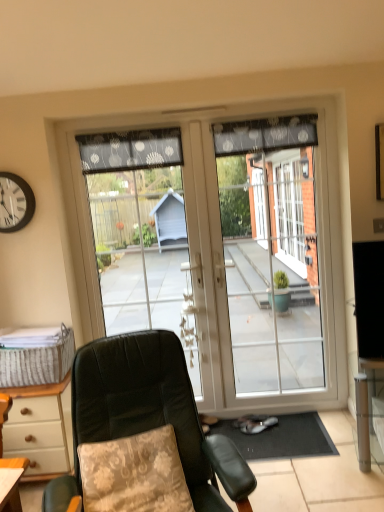
This screenshot has height=512, width=384. In order to click on transparent glass door at center in this screenshot , I will do `click(142, 234)`.

Measure the distance between transparent glass door at center and camera.

A distance of 2.70 meters exists between transparent glass door at center and camera.

You are a GUI agent. You are given a task and a screenshot of the screen. Output one action in this format:
    pyautogui.click(x=<x>, y=<y>)
    Task: Click on the black sheer curtain at upper center, which is the 2th curtain in left-to-right order
    This screenshot has height=512, width=384.
    Given the screenshot: What is the action you would take?
    pyautogui.click(x=264, y=135)

In order to face black sheer curtain at upper center, which is the 2th curtain in left-to-right order, should I rotate leftwards or rightwards?

To align with it, rotate right about 9.487°.

What is the approximate height of floral fabric pillow at lower left?

floral fabric pillow at lower left is 21.10 inches tall.

Find the location of a particular element. This screenshot has height=512, width=384. transparent glass door at center is located at coordinates (275, 267).

The width and height of the screenshot is (384, 512). Describe the element at coordinates (130, 150) in the screenshot. I see `dark gray dotted fabric at upper center, which ranks as the first curtain in left-to-right order` at that location.

Where is `leather-like green chair at center`? leather-like green chair at center is located at coordinates (134, 392).

Measure the distance between leather-like green chair at center and dark gray dotted fabric at upper center, which ranks as the first curtain in left-to-right order.

leather-like green chair at center and dark gray dotted fabric at upper center, which ranks as the first curtain in left-to-right order, are 1.41 meters apart from each other.

Between leather-like green chair at center and dark gray dotted fabric at upper center, which ranks as the first curtain in left-to-right order, which one has larger width?

leather-like green chair at center is wider.

Can you tell me how much leather-like green chair at center and dark gray dotted fabric at upper center, arranged as the second curtain when viewed from the right, differ in facing direction?

18.8 degrees.

Consider the image. Considering the positions of objects leather-like green chair at center and dark gray dotted fabric at upper center, which ranks as the first curtain in left-to-right order, in the image provided, who is more to the right, leather-like green chair at center or dark gray dotted fabric at upper center, which ranks as the first curtain in left-to-right order,?

From the viewer's perspective, leather-like green chair at center appears more on the right side.

Considering their positions, is transparent glass door at center located in front of or behind black sheer curtain at upper center, which is the 2th curtain in left-to-right order?

transparent glass door at center is in front of black sheer curtain at upper center, which is the 2th curtain in left-to-right order.

Is point (307, 268) closer or farther from the camera than point (273, 142)?

Point (307, 268) is farther from the camera than point (273, 142).

Consider the image. Who is smaller, transparent glass door at center or black sheer curtain at upper center, which is the first curtain in right-to-left order?

Smaller between the two is black sheer curtain at upper center, which is the first curtain in right-to-left order.

From the image's perspective, who appears lower, transparent glass door at center or black sheer curtain at upper center, which is the first curtain in right-to-left order?

transparent glass door at center appears lower in the image.

Between black sheer curtain at upper center, which is the 2th curtain in left-to-right order, and floral fabric pillow at lower left, which one has less height?

Result: black sheer curtain at upper center, which is the 2th curtain in left-to-right order, is shorter.

Locate an element on the screen. The height and width of the screenshot is (512, 384). pillow that is in front of the black sheer curtain at upper center, which is the 2th curtain in left-to-right order is located at coordinates (134, 474).

Which is less distant, (x=220, y=133) or (x=174, y=494)?

Point (x=220, y=133).

In the image, is black sheer curtain at upper center, which is the 2th curtain in left-to-right order, on the left side or the right side of floral fabric pillow at lower left?

Clearly, black sheer curtain at upper center, which is the 2th curtain in left-to-right order, is on the right of floral fabric pillow at lower left in the image.

From the image's perspective, between black plastic clock at upper left and black sheer curtain at upper center, which is the 2th curtain in left-to-right order, who is located below?

From the image's view, black plastic clock at upper left is below.

Which is in front, point (17, 183) or point (285, 139)?

The point (17, 183) is closer to the camera.

Is black plastic clock at upper left at the right side of black sheer curtain at upper center, which is the first curtain in right-to-left order?

Incorrect, black plastic clock at upper left is not on the right side of black sheer curtain at upper center, which is the first curtain in right-to-left order.

Considering the sizes of objects floral fabric pillow at lower left and dark gray dotted fabric at upper center, which ranks as the first curtain in left-to-right order, in the image provided, who is smaller, floral fabric pillow at lower left or dark gray dotted fabric at upper center, which ranks as the first curtain in left-to-right order,?

dark gray dotted fabric at upper center, which ranks as the first curtain in left-to-right order, is smaller.

Which is in front, point (151, 483) or point (130, 131)?

Point (151, 483)

Are floral fabric pillow at lower left and dark gray dotted fabric at upper center, arranged as the second curtain when viewed from the right, located far from each other?

Yes, floral fabric pillow at lower left and dark gray dotted fabric at upper center, arranged as the second curtain when viewed from the right, are located far from each other.

From a real-world perspective, which is physically below, black plastic clock at upper left or transparent glass door at center?

From a 3D spatial view, transparent glass door at center is below.

What's the angular difference between black plastic clock at upper left and transparent glass door at center's facing directions?

The facing directions of black plastic clock at upper left and transparent glass door at center are 1.19 degrees apart.

Between black plastic clock at upper left and transparent glass door at center, which one has smaller size?

black plastic clock at upper left.

Is black plastic clock at upper left oriented towards transparent glass door at center?

No, black plastic clock at upper left is not aimed at transparent glass door at center.

Is leather-like green chair at center positioned with its back to transparent glass door at center?

leather-like green chair at center does not have its back to transparent glass door at center.

Is leather-like green chair at center wider than transparent glass door at center?

Indeed, leather-like green chair at center has a greater width compared to transparent glass door at center.

Is leather-like green chair at center taller than transparent glass door at center?

In fact, leather-like green chair at center may be shorter than transparent glass door at center.

Where is `curtain that is the 1st one above the leather-like green chair at center (from a real-world perspective)`? Image resolution: width=384 pixels, height=512 pixels. curtain that is the 1st one above the leather-like green chair at center (from a real-world perspective) is located at coordinates (130, 150).

Identify the location of screen door below the black sheer curtain at upper center, which is the 2th curtain in left-to-right order (from the image's perspective). (275, 267).

Looking at the image, which one is located further to leather-like green chair at center, transparent glass door at center or black plastic clock at upper left?

black plastic clock at upper left is positioned further to the anchor leather-like green chair at center.

Estimate the real-world distances between objects in this image. Which object is closer to transparent glass door at center, black plastic clock at upper left or woven beige picnic basket at lower left?

woven beige picnic basket at lower left is positioned closer to the anchor transparent glass door at center.

Which object lies nearer to the anchor point transparent glass door at center, leather-like green chair at center or black plastic clock at upper left?

Among the two, leather-like green chair at center is located nearer to transparent glass door at center.

Looking at the image, which one is located closer to floral fabric pillow at lower left, transparent glass door at center or dark gray dotted fabric at upper center, which ranks as the first curtain in left-to-right order?

transparent glass door at center lies closer to floral fabric pillow at lower left than the other object.

Based on their spatial positions, is transparent glass door at center or transparent glass door at center further from dark gray dotted fabric at upper center, which ranks as the first curtain in left-to-right order?

Based on the image, transparent glass door at center appears to be further to dark gray dotted fabric at upper center, which ranks as the first curtain in left-to-right order.

When comparing their distances from black sheer curtain at upper center, which is the 2th curtain in left-to-right order, does floral fabric pillow at lower left or transparent glass door at center seem further?

floral fabric pillow at lower left is further to black sheer curtain at upper center, which is the 2th curtain in left-to-right order.

From the image, which object appears to be nearer to black sheer curtain at upper center, which is the first curtain in right-to-left order, dark gray dotted fabric at upper center, which ranks as the first curtain in left-to-right order, or transparent glass door at center?

transparent glass door at center is positioned closer to the anchor black sheer curtain at upper center, which is the first curtain in right-to-left order.

Looking at the image, which one is located further to dark gray dotted fabric at upper center, arranged as the second curtain when viewed from the right, transparent glass door at center or leather-like green chair at center?

leather-like green chair at center.

Locate an element on the screen. The width and height of the screenshot is (384, 512). garage door between woven beige picnic basket at lower left and black sheer curtain at upper center, which is the first curtain in right-to-left order, from left to right is located at coordinates (142, 234).

I want to click on garage door between dark gray dotted fabric at upper center, which ranks as the first curtain in left-to-right order, and floral fabric pillow at lower left, in the vertical direction, so click(x=142, y=234).

Where is `picnic basket between dark gray dotted fabric at upper center, which ranks as the first curtain in left-to-right order, and floral fabric pillow at lower left from top to bottom`? The image size is (384, 512). picnic basket between dark gray dotted fabric at upper center, which ranks as the first curtain in left-to-right order, and floral fabric pillow at lower left from top to bottom is located at coordinates (36, 364).

Find the location of `garage door between black sheer curtain at upper center, which is the 2th curtain in left-to-right order, and transparent glass door at center vertically`. garage door between black sheer curtain at upper center, which is the 2th curtain in left-to-right order, and transparent glass door at center vertically is located at coordinates (142, 234).